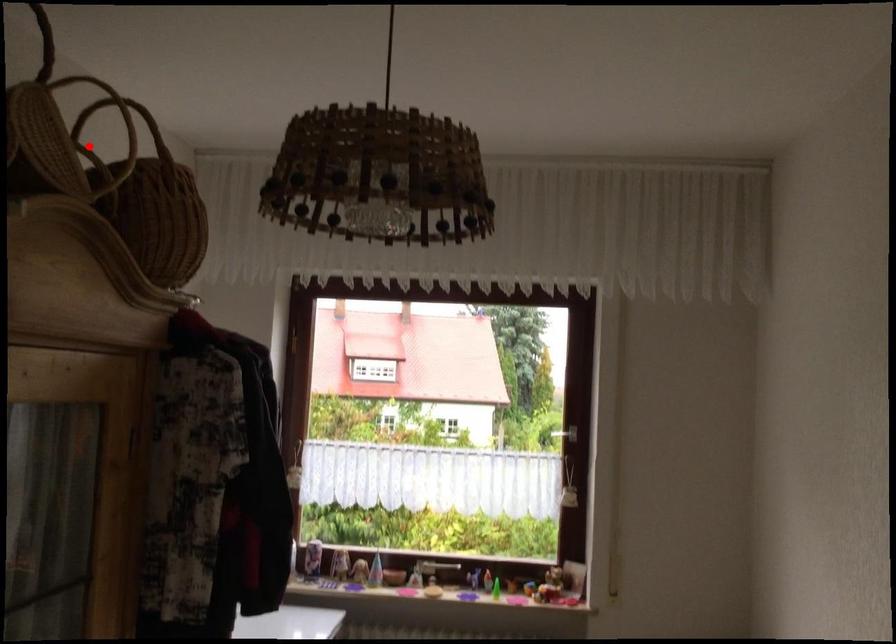
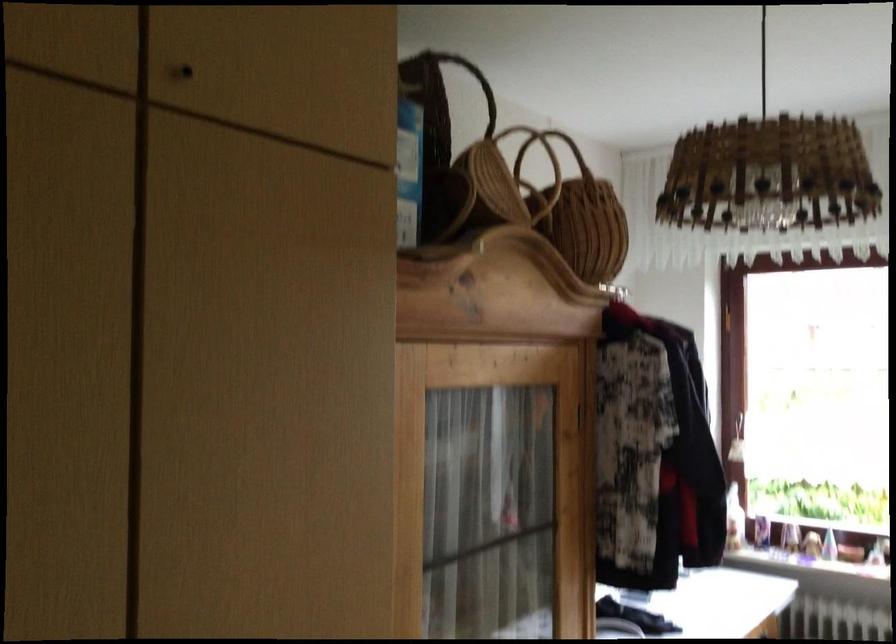
Question: I am providing you with two images of the same scene from different viewpoints. Given a red point in image1, look at the same physical point in image2. Is it:

Choices:
 (A) Closer to the viewpoint
 (B) Farther from the viewpoint

Answer: (B)